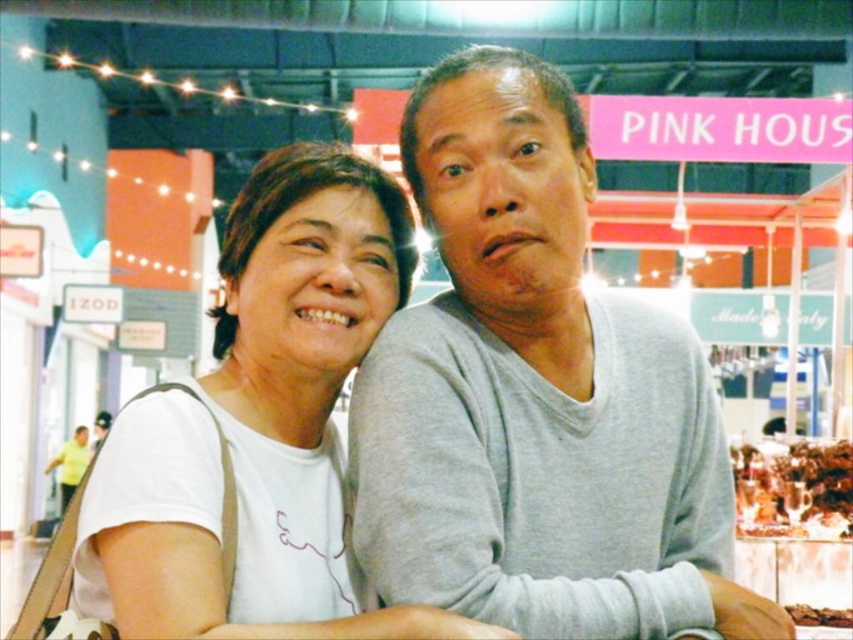
Question: Among these points, which one is nearest to the camera?

Choices:
 (A) (490, 413)
 (B) (785, 609)
 (C) (848, 481)
 (D) (248, 500)

Answer: (D)

Question: Is white cotton t-shirt at center wider than brown matte food at center?

Choices:
 (A) yes
 (B) no

Answer: (A)

Question: Considering the relative positions of gray matte sweater at center and brown matte food at center in the image provided, where is gray matte sweater at center located with respect to brown matte food at center?

Choices:
 (A) below
 (B) above

Answer: (B)

Question: Is gray matte sweater at center positioned behind brown crumbly bread at center?

Choices:
 (A) no
 (B) yes

Answer: (A)

Question: Which point appears farthest from the camera in this image?

Choices:
 (A) (508, 616)
 (B) (822, 493)

Answer: (B)

Question: Which is farther from the brown crumbly bread at center?

Choices:
 (A) gray matte sweater at center
 (B) white cotton t-shirt at center

Answer: (B)